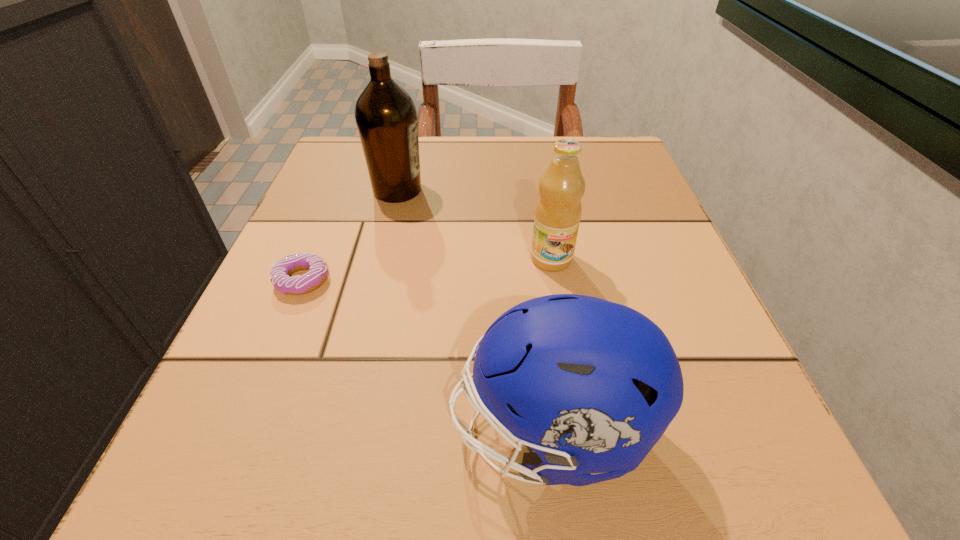
The width and height of the screenshot is (960, 540). I want to click on vacant space situated 0.100m on the front-facing side of the nearest object, so click(x=365, y=431).

Where is `vacant region located on the front-facing side of the nearest object`? Image resolution: width=960 pixels, height=540 pixels. vacant region located on the front-facing side of the nearest object is located at coordinates (296, 431).

You are a GUI agent. You are given a task and a screenshot of the screen. Output one action in this format:
    pyautogui.click(x=<x>, y=<y>)
    Task: Click on the vacant point located on the right of the doughnut
    This screenshot has height=540, width=960.
    Given the screenshot: What is the action you would take?
    pyautogui.click(x=521, y=280)

Where is `object at the far edge`? The height and width of the screenshot is (540, 960). object at the far edge is located at coordinates (386, 117).

The width and height of the screenshot is (960, 540). Find the location of `object positioned at the near edge`. object positioned at the near edge is located at coordinates (589, 385).

This screenshot has height=540, width=960. In order to click on olive oil present at the left edge in this screenshot , I will do `click(386, 117)`.

I want to click on doughnut at the left edge, so click(x=280, y=271).

The width and height of the screenshot is (960, 540). I want to click on object located at the right edge, so tap(589, 385).

Find the location of a particular element. The width and height of the screenshot is (960, 540). object at the far left corner is located at coordinates (386, 117).

Find the location of `object at the near right corner`. object at the near right corner is located at coordinates (589, 385).